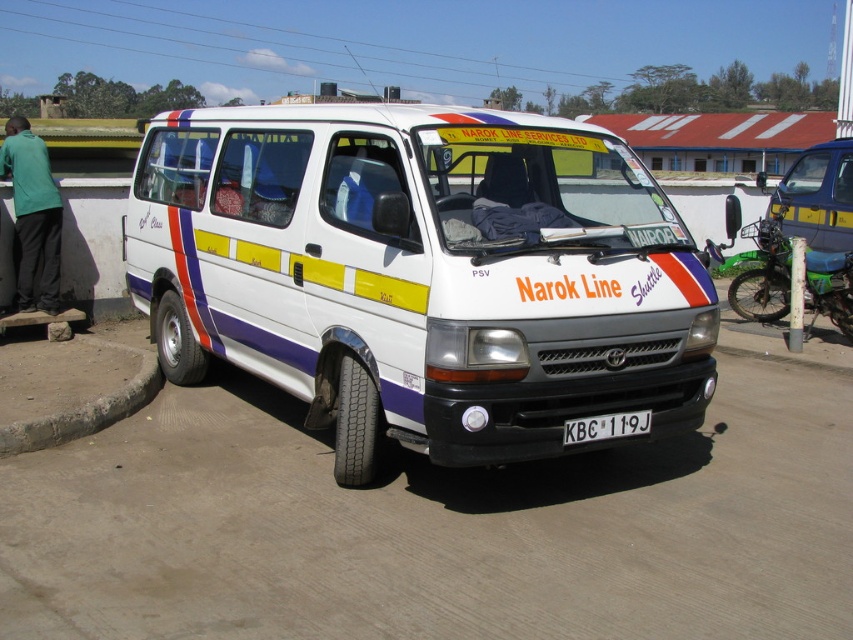
Question: Estimate the real-world distances between objects in this image. Which object is farther from the dirt track at center?

Choices:
 (A) white glossy van at center
 (B) black plastic license plate at center

Answer: (A)

Question: Does green fabric shirt at left appear over black plastic license plate at center?

Choices:
 (A) yes
 (B) no

Answer: (A)

Question: Does dirt track at center appear under white glossy van at center?

Choices:
 (A) yes
 (B) no

Answer: (A)

Question: Estimate the real-world distances between objects in this image. Which object is farther from the dirt track at center?

Choices:
 (A) white glossy van at center
 (B) green fabric shirt at left
 (C) green plastic motorcycle at right
 (D) black plastic license plate at center

Answer: (B)

Question: In this image, where is white glossy van at center located relative to green fabric shirt at left?

Choices:
 (A) left
 (B) right

Answer: (B)

Question: Which point is closer to the camera?

Choices:
 (A) (32, 276)
 (B) (740, 308)
 (C) (579, 417)

Answer: (C)